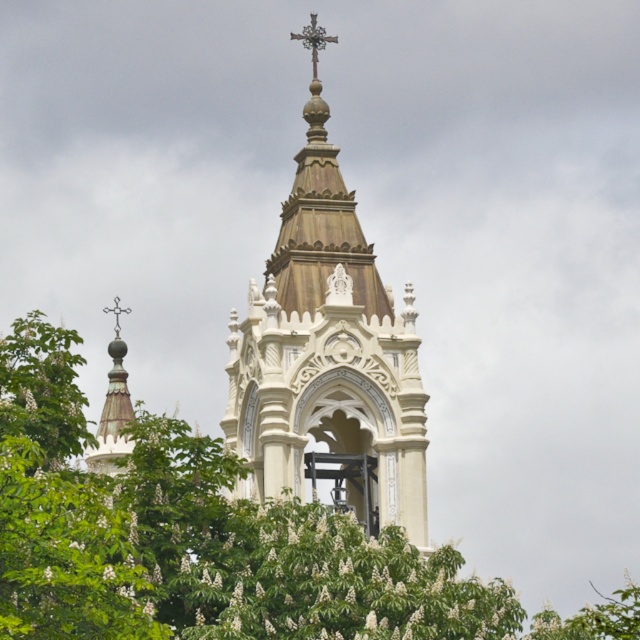
You are standing in front of the church and want to take a photo of both the green leafy tree at center and the white carved stone bell tower at center. Which object should you adjust your camera focus on first to ensure both are in the frame?

You should focus on the green leafy tree at center first because it is closer to the viewer, allowing you to adjust the framing to include both it and the white carved stone bell tower at center in the photo.

You are standing in front of the church bell tower and notice the green leafy tree at center and the polished bronze cross at upper center. Which object appears taller in the image?

The green leafy tree at center is taller than the polished bronze cross at upper center according to the description.

You are standing in front of the church and want to take a photo of the polished bronze cross at upper center without the green leafy tree at center blocking it. Which direction should you move to ensure the cross is visible?

Move to the left or right to avoid the green leafy tree at center blocking the view of the polished bronze cross at upper center.